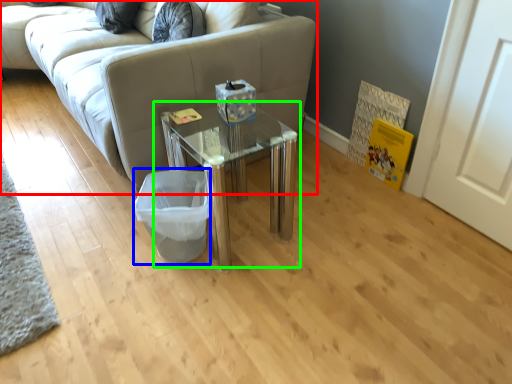
Question: Estimate the real-world distances between objects in this image. Which object is closer to studio couch (highlighted by a red box), laundry basket (highlighted by a blue box) or table (highlighted by a green box)?

Choices:
 (A) laundry basket
 (B) table

Answer: (B)